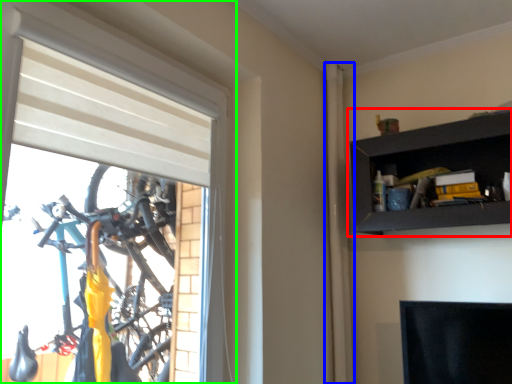
Question: Which is farther away from shelf (highlighted by a red box)? curtain (highlighted by a blue box) or window (highlighted by a green box)?

Choices:
 (A) curtain
 (B) window

Answer: (B)